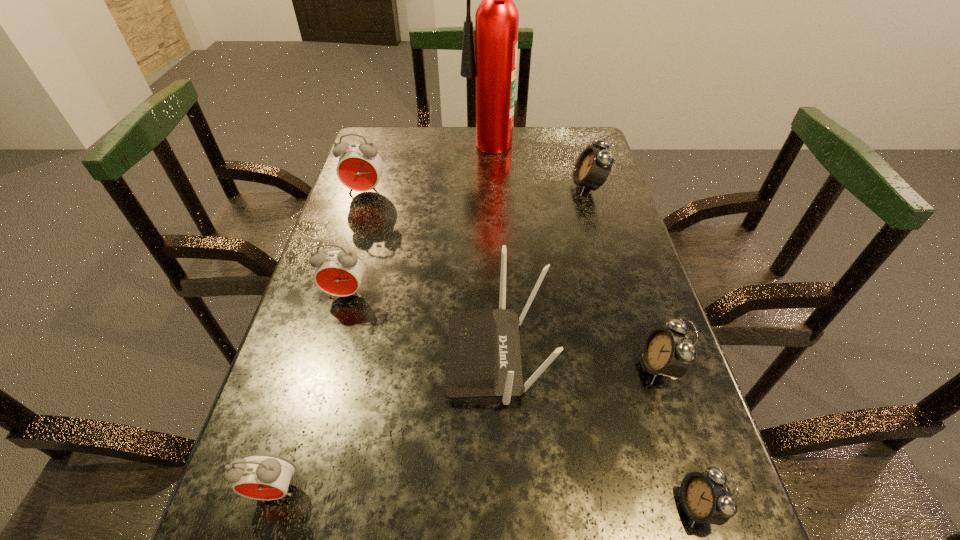
The width and height of the screenshot is (960, 540). What are the coordinates of `empty location between the second biggest red alarm clock and the farthest white alarm clock` in the screenshot? It's located at (468, 240).

This screenshot has width=960, height=540. Find the location of `vacant space in between the router and the second smallest red alarm clock`. vacant space in between the router and the second smallest red alarm clock is located at coordinates (421, 326).

Find the location of a particular element. the third closest object to the shortest object is located at coordinates (258, 476).

At what (x,y) coordinates should I click in order to perform the action: click on the sixth closest object relative to the router. Please return your answer as a coordinate pair (x, y). This screenshot has height=540, width=960. Looking at the image, I should click on click(x=360, y=166).

Identify which alarm clock is the fifth nearest to the biggest white alarm clock. Please provide its 2D coordinates. Your answer should be formatted as a tuple, i.e. [(x, y)], where the tuple contains the x and y coordinates of a point satisfying the conditions above.

[(258, 476)]

Locate an element on the screen. The width and height of the screenshot is (960, 540). alarm clock that is the fourth closest to the farthest object is located at coordinates (667, 352).

Select which red alarm clock is the third closest to the second biggest white alarm clock. Please provide its 2D coordinates. Your answer should be formatted as a tuple, i.e. [(x, y)], where the tuple contains the x and y coordinates of a point satisfying the conditions above.

[(360, 166)]

I want to click on the second closest red alarm clock to the router, so click(258, 476).

You are a GUI agent. You are given a task and a screenshot of the screen. Output one action in this format:
    pyautogui.click(x=<x>, y=<y>)
    Task: Click on the closest white alarm clock relative to the router
    
    Given the screenshot: What is the action you would take?
    pyautogui.click(x=667, y=352)

Where is `white alarm clock that is the closest to the router`? This screenshot has height=540, width=960. white alarm clock that is the closest to the router is located at coordinates coord(667,352).